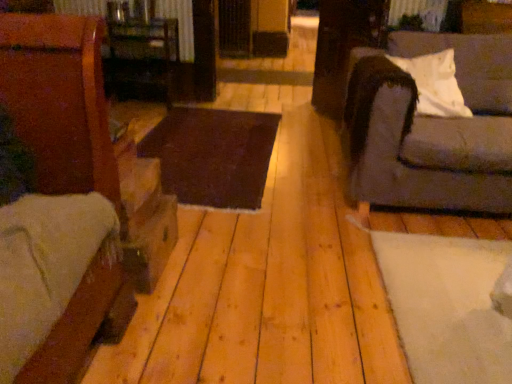
Question: Should I look upward or downward to see natural wood floor at center?

Choices:
 (A) down
 (B) up

Answer: (B)

Question: Is gray fabric couch at right at the right side of brown wood table at center, the first table in the bottom-to-top sequence?

Choices:
 (A) yes
 (B) no

Answer: (A)

Question: Could you tell me if gray fabric couch at right is facing brown wood table at center, marked as the second table in a top-to-bottom arrangement?

Choices:
 (A) yes
 (B) no

Answer: (B)

Question: From a real-world perspective, does gray fabric couch at right sit lower than brown wood table at center, the first table in the bottom-to-top sequence?

Choices:
 (A) yes
 (B) no

Answer: (B)

Question: Can you confirm if gray fabric couch at right is wider than brown wood table at center, the first table in the bottom-to-top sequence?

Choices:
 (A) yes
 (B) no

Answer: (B)

Question: Can you confirm if gray fabric couch at right is thinner than brown wood table at center, the first table in the bottom-to-top sequence?

Choices:
 (A) no
 (B) yes

Answer: (B)

Question: From a real-world perspective, is gray fabric couch at right on brown wood table at center, marked as the second table in a top-to-bottom arrangement?

Choices:
 (A) no
 (B) yes

Answer: (B)

Question: Is brown wood table at center, the first table in the bottom-to-top sequence, not near white soft pillow at right?

Choices:
 (A) yes
 (B) no

Answer: (A)

Question: Is white soft pillow at right completely or partially inside brown wood table at center, marked as the second table in a top-to-bottom arrangement?

Choices:
 (A) yes
 (B) no

Answer: (B)

Question: Does brown wood table at center, the first table in the bottom-to-top sequence, have a larger size compared to white soft pillow at right?

Choices:
 (A) no
 (B) yes

Answer: (B)

Question: Does brown wood table at center, the first table in the bottom-to-top sequence, appear on the left side of white soft pillow at right?

Choices:
 (A) yes
 (B) no

Answer: (A)

Question: Does brown wood table at center, the first table in the bottom-to-top sequence, have a greater width compared to white soft pillow at right?

Choices:
 (A) no
 (B) yes

Answer: (B)

Question: Is brown wood table at center, marked as the second table in a top-to-bottom arrangement, shorter than white soft pillow at right?

Choices:
 (A) no
 (B) yes

Answer: (B)

Question: Is natural wood floor at center surrounded by white soft pillow at right?

Choices:
 (A) no
 (B) yes

Answer: (A)